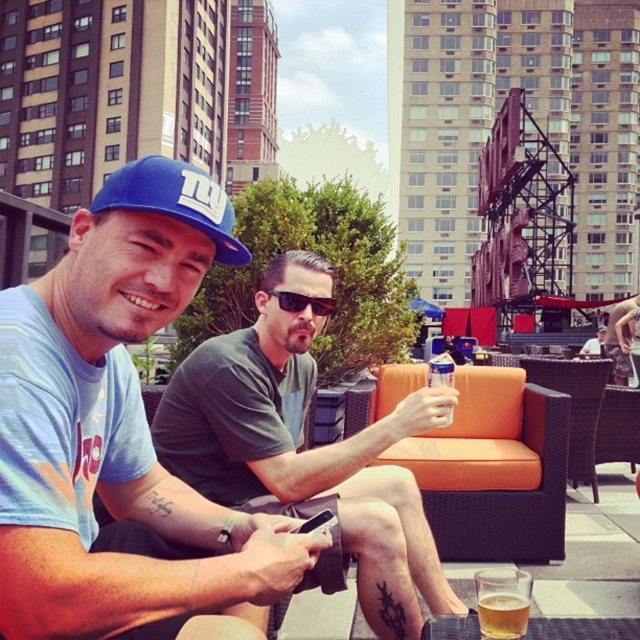
What object is located at the coordinates point [304,301] in the image?

The point [304,301] is on black plastic sunglasses at center.